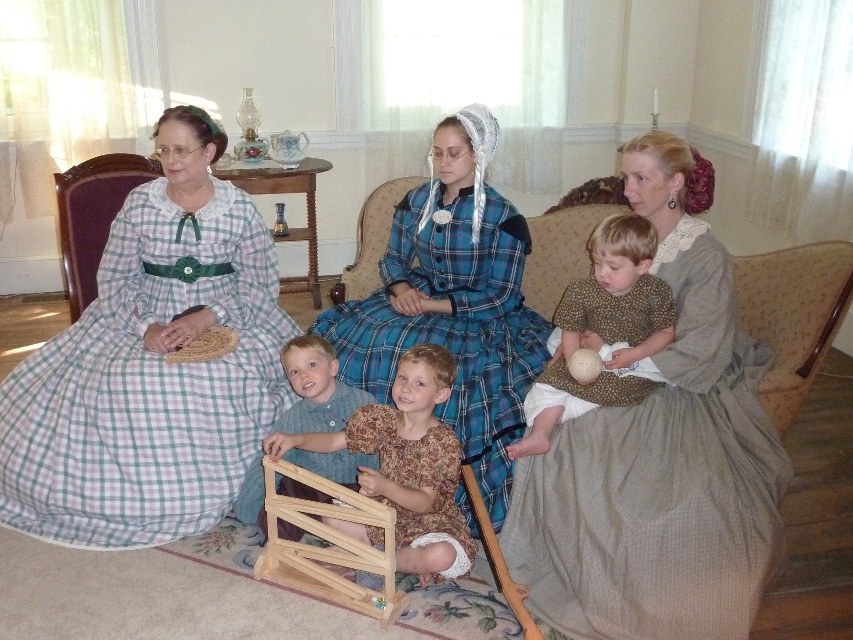
Who is more forward, (598,428) or (410,403)?

Positioned in front is point (598,428).

Does matte gray dress at right appear on the left side of wooden toy at center?

In fact, matte gray dress at right is to the right of wooden toy at center.

Is point (523, 502) more distant than point (372, 442)?

No, (523, 502) is in front of (372, 442).

Identify the location of matte gray dress at right. (660, 481).

Who is shorter, plaid cotton dress at left or green plaid dress at left?

With less height is green plaid dress at left.

Is plaid cotton dress at left taller than green plaid dress at left?

Indeed, plaid cotton dress at left has a greater height compared to green plaid dress at left.

Is point (229, 400) positioned behind point (64, 268)?

No, it is not.

Identify the location of plaid cotton dress at left. (148, 381).

Who is higher up, matte gray dress at right or brown textured fabric at center?

Positioned higher is brown textured fabric at center.

Looking at this image, who is positioned more to the right, matte gray dress at right or brown textured fabric at center?

Positioned to the right is matte gray dress at right.

Does point (744, 360) come in front of point (612, 323)?

No, (744, 360) is behind (612, 323).

This screenshot has height=640, width=853. I want to click on matte gray dress at right, so click(660, 481).